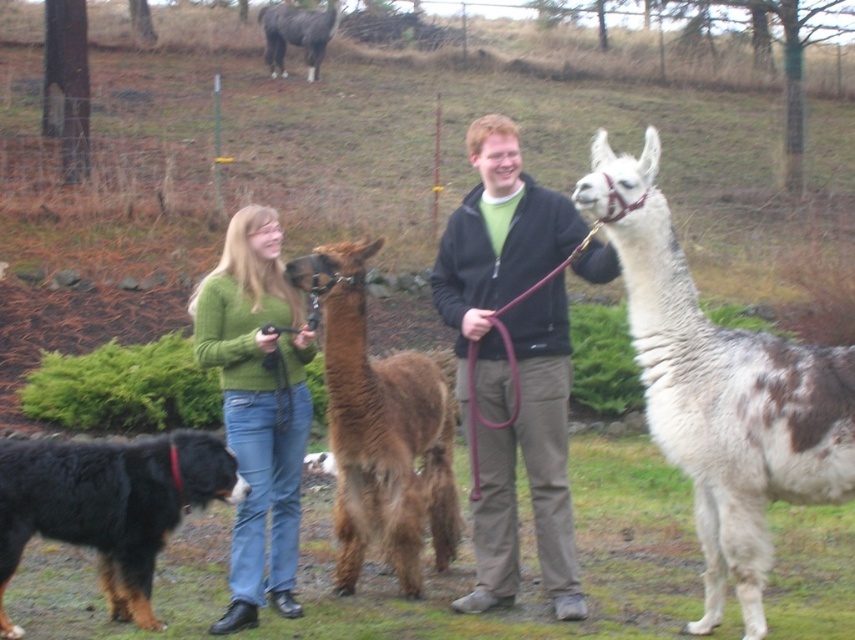
Question: Which object is positioned closest to the green sweater at center?

Choices:
 (A) white woolen alpaca at right
 (B) black fur dog at lower left
 (C) matte brown alpaca at center
 (D) dark brown leather jacket at center

Answer: (B)

Question: Can you confirm if matte brown alpaca at center is positioned to the right of dark gray wool alpaca at upper center?

Choices:
 (A) yes
 (B) no

Answer: (A)

Question: Can you confirm if matte brown alpaca at center is positioned to the right of dark gray wool alpaca at upper center?

Choices:
 (A) no
 (B) yes

Answer: (B)

Question: Which object is positioned closest to the white woolen alpaca at right?

Choices:
 (A) matte brown alpaca at center
 (B) black fur dog at lower left
 (C) dark gray wool alpaca at upper center
 (D) brown fuzzy alpaca at center

Answer: (A)

Question: Does matte brown alpaca at center appear on the left side of brown fuzzy alpaca at center?

Choices:
 (A) no
 (B) yes

Answer: (A)

Question: Which point is closer to the camera?

Choices:
 (A) (60, 540)
 (B) (482, 326)

Answer: (B)